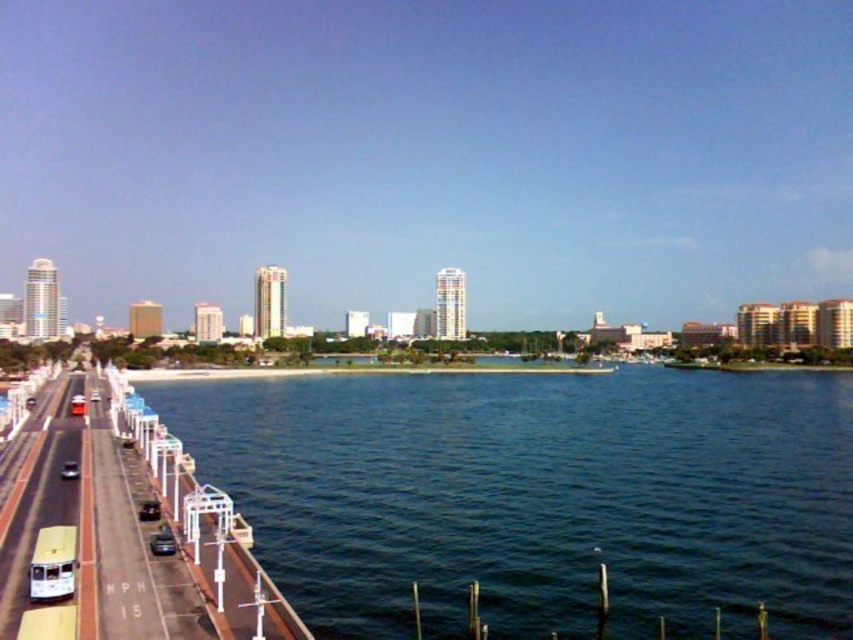
You are driving a car and want to overtake the white glossy bus at left on the road. Can you see the clear blue water at center through the space between the bus and the road edge?

The white glossy bus at left is behind clear blue water at center, so the bus is positioned farther away from you than the water. Since the bus is behind the water, you can see the clear blue water at center through the space between the bus and the road edge.

You are a pedestrian standing on the road and want to cross to the other side. The white glossy bus at left is blocking your path. Can you walk around it using the space between it and the shiny black car at lower left?

The white glossy bus at left is larger in size than the shiny black car at lower left, so there might not be enough space between them to walk around safely. It is recommended to wait for a safer opportunity or find an alternative route.